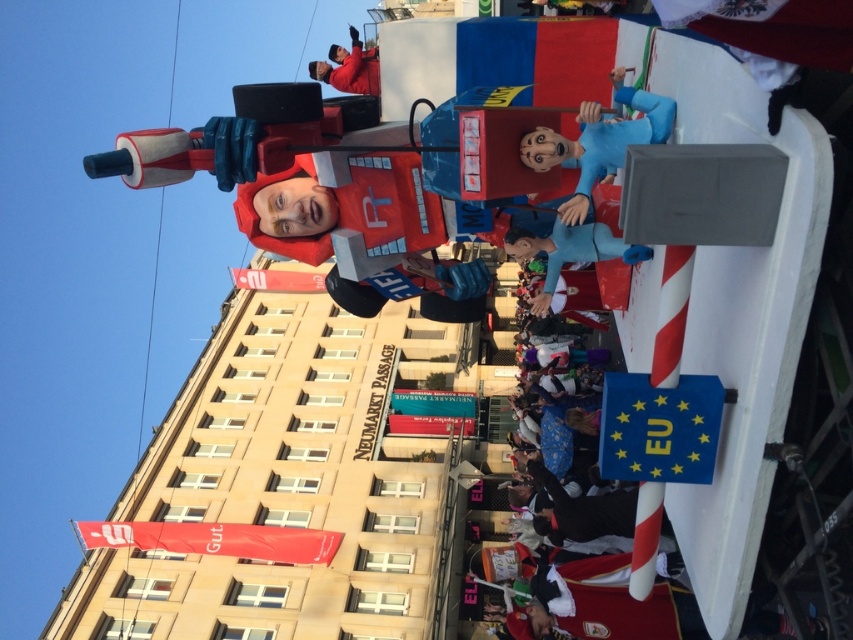
Question: Estimate the real-world distances between objects in this image. Which object is farther from the blue fabric figure at center?

Choices:
 (A) yellowmaterial/textureflag at lower center
 (B) orange fabric flag at center
 (C) blue matte figure at center
 (D) red jacket at upper center

Answer: (B)

Question: Can you confirm if red fabric banner at lower left is positioned to the right of red jacket at upper center?

Choices:
 (A) yes
 (B) no

Answer: (B)

Question: Does red jacket at upper center have a lesser width compared to orange fabric flag at center?

Choices:
 (A) yes
 (B) no

Answer: (A)

Question: Which point appears farthest from the camera in this image?

Choices:
 (A) (225, 536)
 (B) (636, 385)
 (C) (369, 312)

Answer: (A)

Question: Estimate the real-world distances between objects in this image. Which object is closer to the blue matte figure at center?

Choices:
 (A) blue fabric figure at center
 (B) red jacket at upper center
 (C) blue matte mannequin at center

Answer: (A)

Question: Can you confirm if blue matte figure at center is wider than blue fabric figure at center?

Choices:
 (A) yes
 (B) no

Answer: (B)